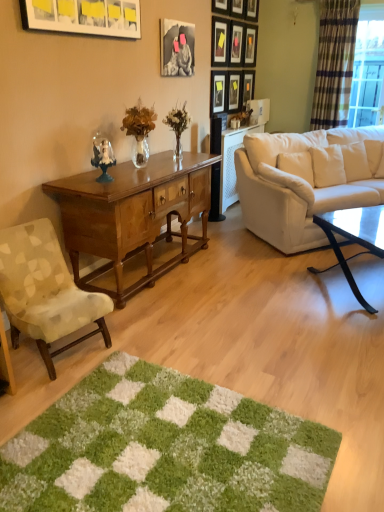
Locate an element on the screen. Image resolution: width=384 pixels, height=512 pixels. free region under green shaggy rug at lower center (from a real-world perspective) is located at coordinates click(x=192, y=473).